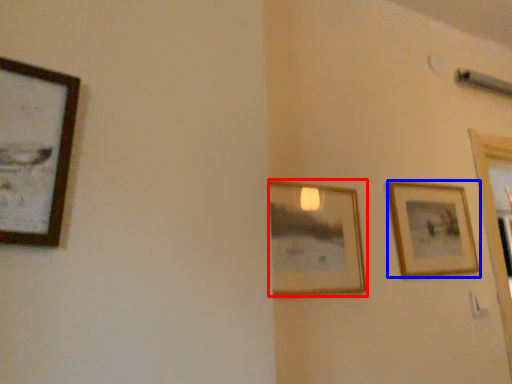
Question: Among these objects, which one is farthest to the camera, picture frame (highlighted by a red box) or picture frame (highlighted by a blue box)?

Choices:
 (A) picture frame
 (B) picture frame

Answer: (B)